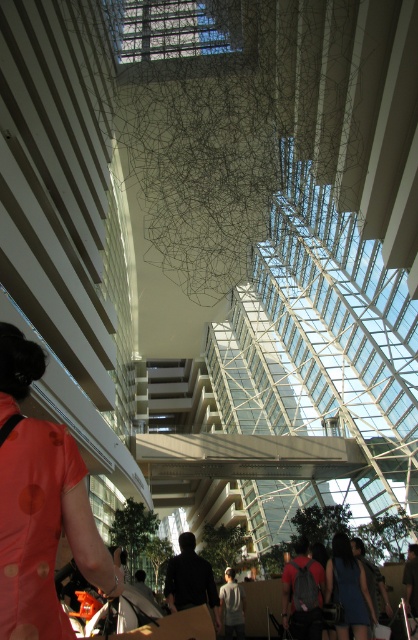
Question: In this image, where is orange dotted shirt at lower left located relative to blue denim dress at center?

Choices:
 (A) above
 (B) below

Answer: (A)

Question: Which point is closer to the camera?

Choices:
 (A) (362, 605)
 (B) (28, 518)

Answer: (B)

Question: Does orange dotted shirt at lower left appear on the right side of blue denim dress at center?

Choices:
 (A) yes
 (B) no

Answer: (B)

Question: Can you confirm if orange dotted shirt at lower left is positioned above blue denim dress at center?

Choices:
 (A) no
 (B) yes

Answer: (B)

Question: Which object appears farthest from the camera in this image?

Choices:
 (A) orange dotted shirt at lower left
 (B) blue denim dress at center

Answer: (B)